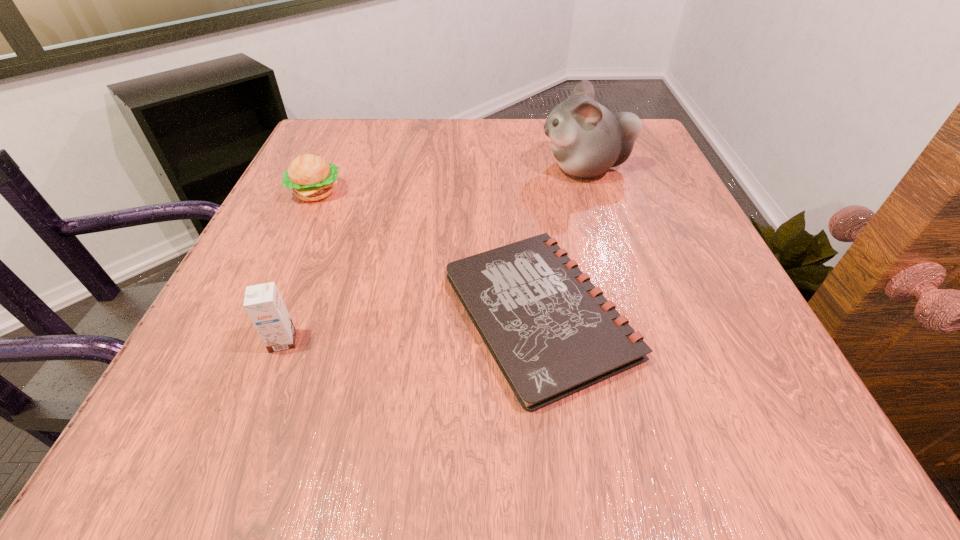
Find the location of a particular element. The width and height of the screenshot is (960, 540). vacant area that lies between the hamburger and the hamster is located at coordinates (450, 180).

The image size is (960, 540). I want to click on empty location between the hamster and the shortest object, so click(562, 241).

Identify which object is located as the nearest to the second tallest object. Please provide its 2D coordinates. Your answer should be formatted as a tuple, i.e. [(x, y)], where the tuple contains the x and y coordinates of a point satisfying the conditions above.

[(552, 333)]

Image resolution: width=960 pixels, height=540 pixels. What are the coordinates of `object identified as the third closest to the tallest object` in the screenshot? It's located at (263, 303).

At what (x,y) coordinates should I click in order to perform the action: click on free spot that satisfies the following two spatial constraints: 1. on the face of the tallest object; 2. on the front side of the chocolate milk. Please return your answer as a coordinate pair (x, y). Looking at the image, I should click on (639, 341).

You are a GUI agent. You are given a task and a screenshot of the screen. Output one action in this format:
    pyautogui.click(x=<x>, y=<y>)
    Task: Click on the vacant area that satisfies the following two spatial constraints: 1. on the front side of the notebook; 2. on the right side of the hamburger
    The width and height of the screenshot is (960, 540).
    Given the screenshot: What is the action you would take?
    pyautogui.click(x=260, y=313)